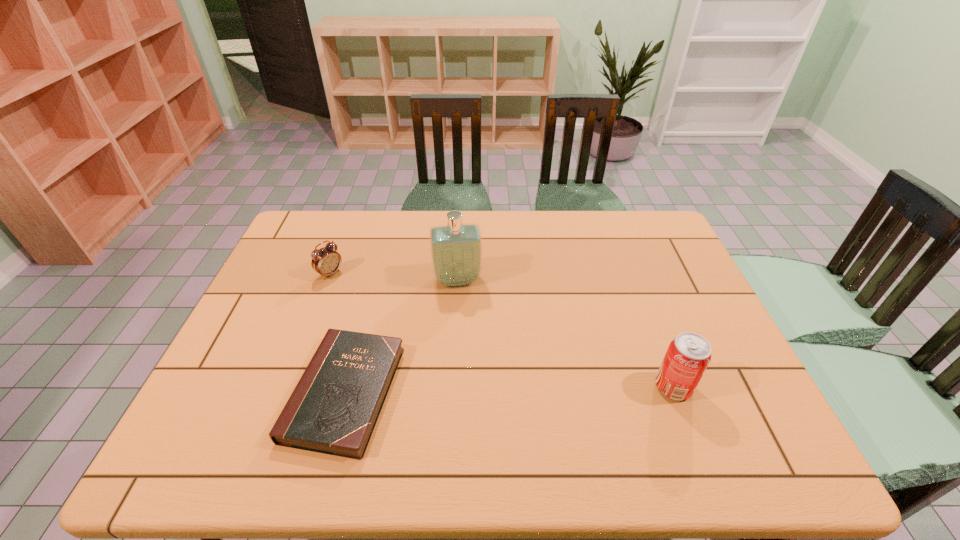
You are a GUI agent. You are given a task and a screenshot of the screen. Output one action in this format:
    pyautogui.click(x=<x>, y=<y>)
    Task: Click on the free spot located 0.220m on the front label of the second object from right to left
    The height and width of the screenshot is (540, 960).
    Given the screenshot: What is the action you would take?
    point(468,349)

What are the coordinates of `free location located 0.160m on the face of the alarm clock` in the screenshot? It's located at (372, 303).

Where is `free space located on the face of the alarm clock`? This screenshot has width=960, height=540. free space located on the face of the alarm clock is located at coordinates (359, 294).

Where is `free spot located 0.180m on the face of the alarm clock`? free spot located 0.180m on the face of the alarm clock is located at coordinates (376, 307).

The height and width of the screenshot is (540, 960). In order to click on Bible that is positioned at the near edge in this screenshot , I will do tap(333, 409).

The height and width of the screenshot is (540, 960). Identify the location of soda can situated at the near edge. (688, 355).

Image resolution: width=960 pixels, height=540 pixels. I want to click on object at the left edge, so click(x=326, y=261).

Image resolution: width=960 pixels, height=540 pixels. Find the location of `object that is at the right edge`. object that is at the right edge is located at coordinates (688, 355).

Locate an element on the screen. The width and height of the screenshot is (960, 540). object located in the near right corner section of the desktop is located at coordinates (688, 355).

Where is `free location at the far edge`? free location at the far edge is located at coordinates (373, 238).